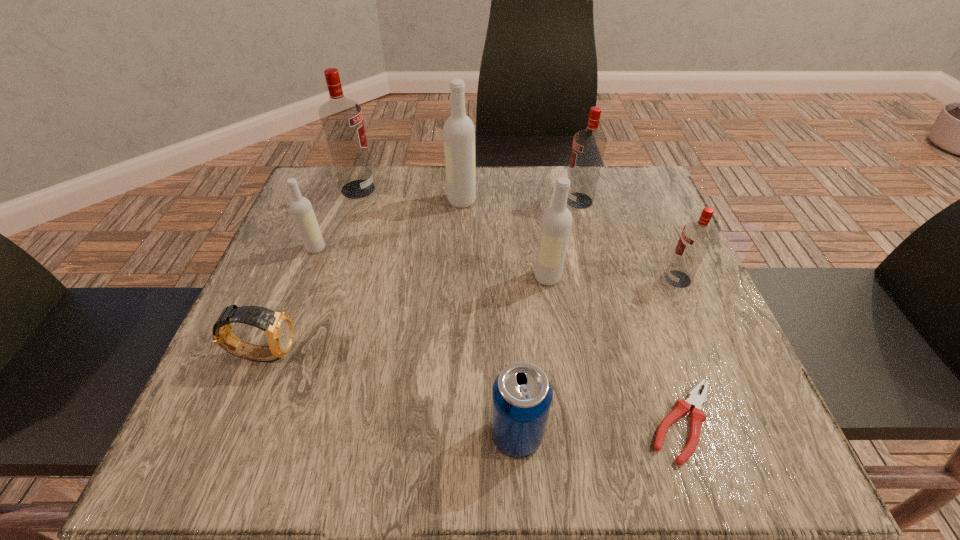
Where is `the second nearest white vodka`? the second nearest white vodka is located at coordinates (301, 208).

At what (x,y) coordinates should I click in order to perform the action: click on pop soda. Please return your answer as a coordinate pair (x, y). Image resolution: width=960 pixels, height=540 pixels. Looking at the image, I should click on (522, 395).

Find the location of a particular element. The height and width of the screenshot is (540, 960). the seventh tallest object is located at coordinates (522, 395).

Find the location of a particular element. The width and height of the screenshot is (960, 540). watch is located at coordinates (x=278, y=327).

The image size is (960, 540). Identify the location of gold watch. (278, 327).

Identify the location of pliers. (697, 415).

This screenshot has height=540, width=960. Find the location of `vacant area situated 0.130m on the right of the sixth object from right to left`. vacant area situated 0.130m on the right of the sixth object from right to left is located at coordinates (528, 201).

The height and width of the screenshot is (540, 960). Find the location of `blank area located 0.260m on the front label of the biggest red vodka`. blank area located 0.260m on the front label of the biggest red vodka is located at coordinates (477, 189).

I want to click on free spot located 0.340m on the front label of the second red vodka from left to right, so click(428, 200).

You are a GUI agent. You are given a task and a screenshot of the screen. Output one action in this format:
    pyautogui.click(x=<x>, y=<y>)
    Task: Click on the blank space located on the front label of the second red vodka from left to right
    The height and width of the screenshot is (540, 960).
    Given the screenshot: What is the action you would take?
    pyautogui.click(x=484, y=200)